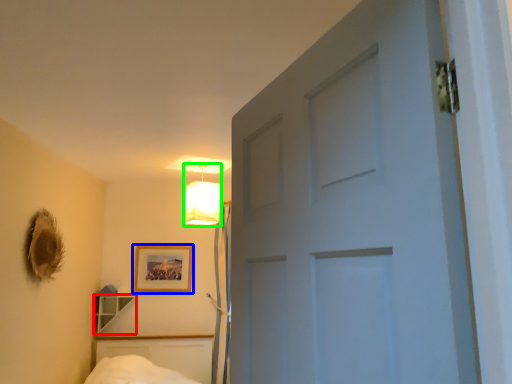
Question: Estimate the real-world distances between objects in this image. Which object is closer to shelf (highlighted by a red box), picture frame (highlighted by a blue box) or lamp (highlighted by a green box)?

Choices:
 (A) picture frame
 (B) lamp

Answer: (A)